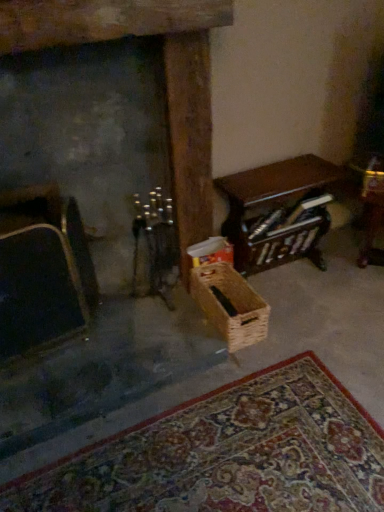
Question: Does point (221, 334) appear closer or farther from the camera than point (244, 244)?

Choices:
 (A) farther
 (B) closer

Answer: (B)

Question: From a real-world perspective, is woven brown basket at center positioned above or below wooden table at right?

Choices:
 (A) above
 (B) below

Answer: (B)

Question: Which is nearer to the wooden table at right?

Choices:
 (A) woven brown basket at center
 (B) velvet black armchair at left
 (C) dark gray stone fireplace at left

Answer: (A)

Question: Based on their relative distances, which object is nearer to the dark gray stone fireplace at left?

Choices:
 (A) wooden table at right
 (B) woven brown basket at center
 (C) velvet black armchair at left

Answer: (A)